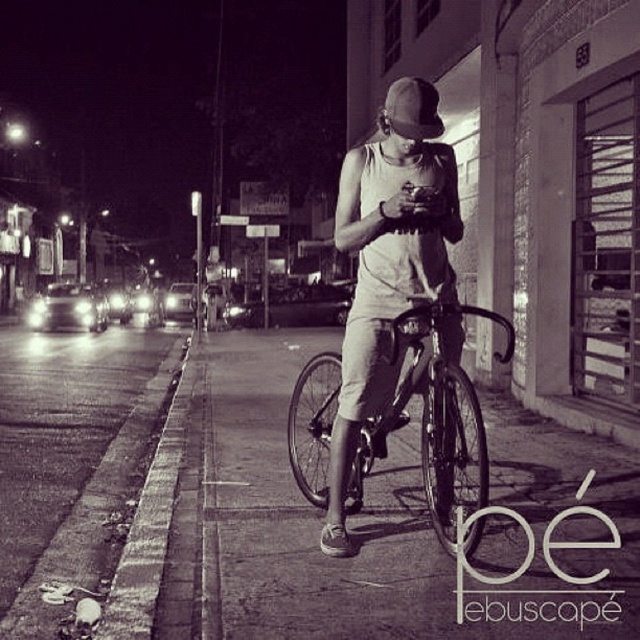
Who is positioned more to the left, metallic silver bicycle at center or matte black baseball hat at center?

From the viewer's perspective, metallic silver bicycle at center appears more on the left side.

Find the location of a particular element. The image size is (640, 640). metallic silver bicycle at center is located at coordinates (432, 416).

Can you confirm if matte white tank top at center is positioned above metallic silver bicycle at center?

Yes.

Between point (445, 454) and point (436, 317), which one is positioned in front?

Point (436, 317) is more forward.

Image resolution: width=640 pixels, height=640 pixels. I want to click on matte white tank top at center, so click(387, 262).

Can you confirm if matte white tank top at center is wider than matte black baseball hat at center?

In fact, matte white tank top at center might be narrower than matte black baseball hat at center.

Is matte white tank top at center above matte black baseball hat at center?

No, matte white tank top at center is not above matte black baseball hat at center.

Describe the element at coordinates (387, 262) in the screenshot. Image resolution: width=640 pixels, height=640 pixels. I see `matte white tank top at center` at that location.

At what (x,y) coordinates should I click in order to perform the action: click on matte white tank top at center. Please return your answer as a coordinate pair (x, y). Image resolution: width=640 pixels, height=640 pixels. Looking at the image, I should click on (387, 262).